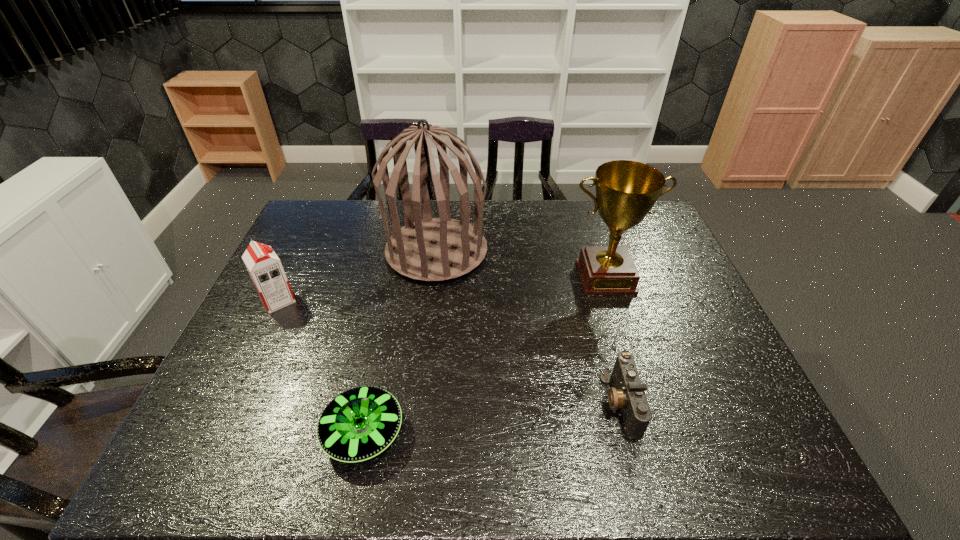
This screenshot has height=540, width=960. In order to click on vacant area that lies between the saucer and the fourth shortest object in this screenshot , I will do `click(485, 355)`.

The width and height of the screenshot is (960, 540). What are the coordinates of `free space between the third shortest object and the saucer` in the screenshot? It's located at (321, 366).

Identify the location of vacant area that lies between the saucer and the soya milk. (321, 366).

Locate which object ranks third in proximity to the fourth shortest object. Please provide its 2D coordinates. Your answer should be formatted as a tuple, i.e. [(x, y)], where the tuple contains the x and y coordinates of a point satisfying the conditions above.

[(358, 424)]

Find the location of a particular element. Image resolution: width=960 pixels, height=540 pixels. the closest object to the saucer is located at coordinates (263, 265).

This screenshot has width=960, height=540. Identify the location of vacant space that satisfies the following two spatial constraints: 1. on the back side of the third shortest object; 2. on the left side of the tallest object. (301, 251).

The image size is (960, 540). What are the coordinates of `free spot that satisfies the following two spatial constraints: 1. on the back side of the birdcage; 2. on the left side of the third shortest object` in the screenshot? It's located at (301, 251).

Find the location of a particular element. free spot that satisfies the following two spatial constraints: 1. on the plaque of the award; 2. on the front-facing side of the camera is located at coordinates (645, 403).